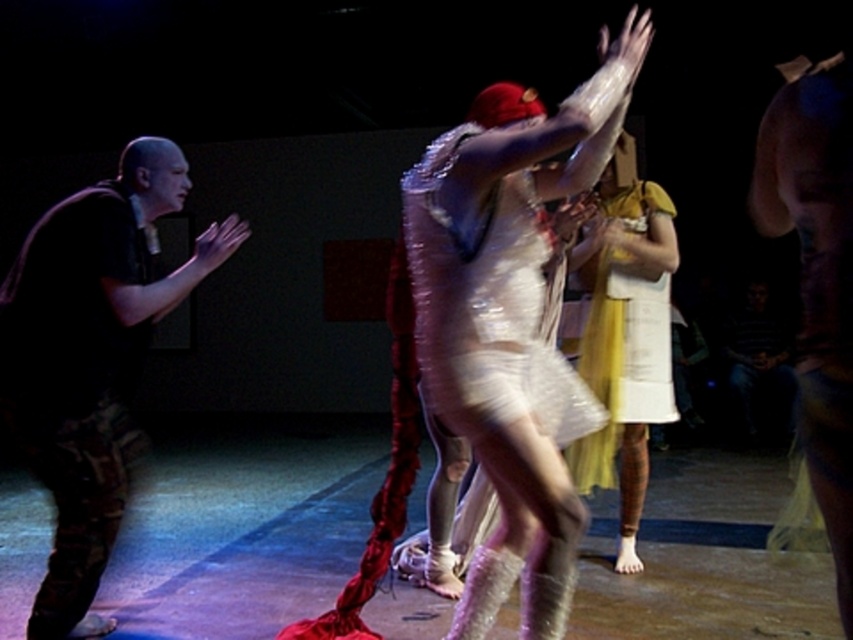
Looking at this image, you are a photographer trying to capture the performers. The shiny silver dress at center and the camouflage pants at right are both in your viewfinder. Which of these two items will appear wider in your photo?

The shiny silver dress at center will appear wider in the photo since its width surpasses that of the camouflage pants at right.

You are a photographer at the event and need to adjust your camera settings to capture both the shiny white dress at center and the camouflage pants at right clearly. Considering their sizes, which object should you focus on first to ensure proper exposure?

The shiny white dress at center is larger in size than the camouflage pants at right, so focusing on the shiny white dress at center first will help balance the exposure since it occupies more of the frame.